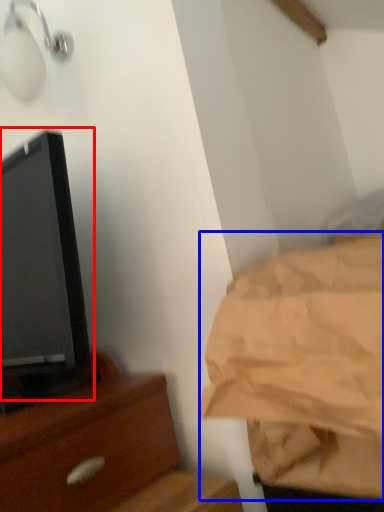
Question: Which object appears closest to the camera in this image, tv show (highlighted by a red box) or sheet (highlighted by a blue box)?

Choices:
 (A) tv show
 (B) sheet

Answer: (B)